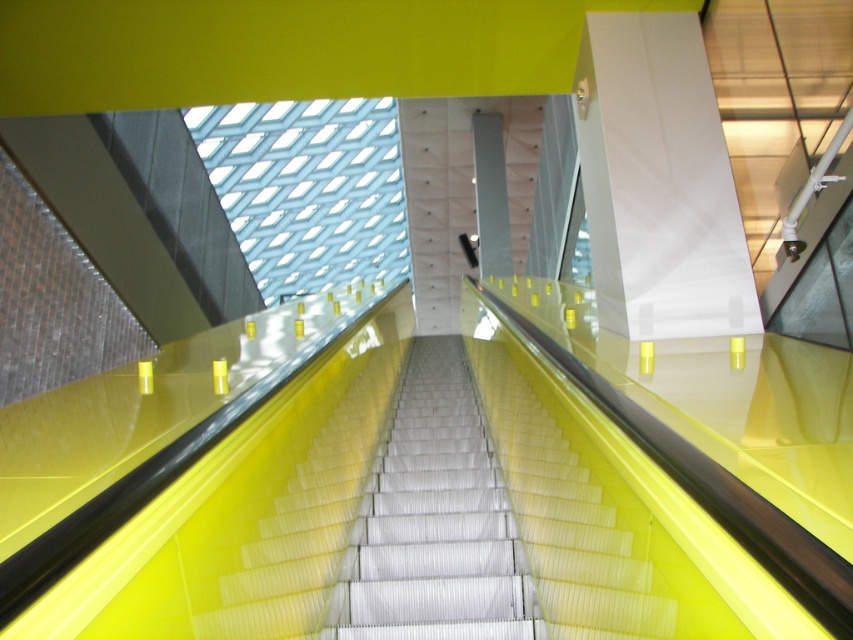
You are standing at the bottom of the escalator and want to take a photo of the ceiling. There are two points marked as point (x=416, y=339) and point (x=648, y=516) on the ceiling. Which point will be closer to your camera lens when you aim upwards?

Point (x=416, y=339) is further to the camera than point (x=648, y=516), so the point (x=648, y=516) will be closer to your camera lens when you aim upwards.